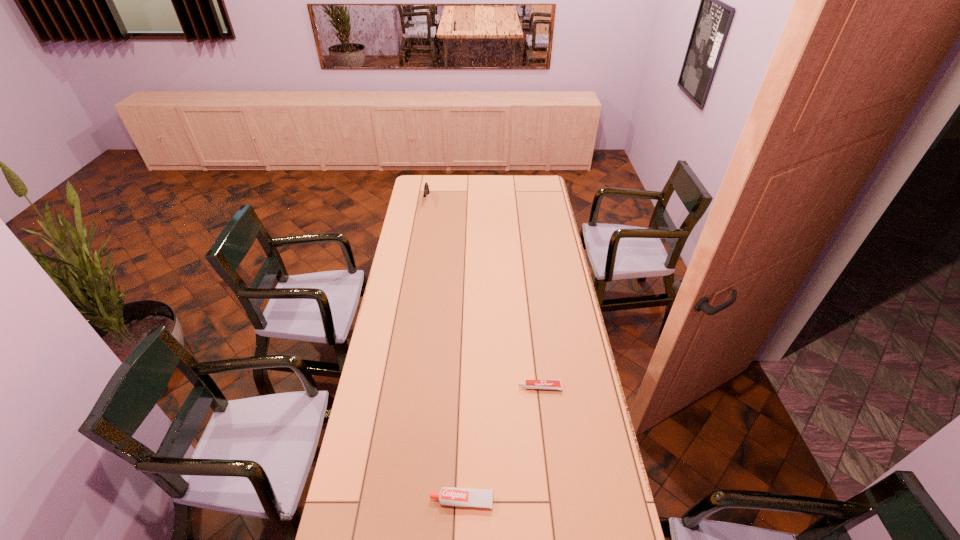
Find the location of a particular element. This screenshot has height=540, width=960. gun is located at coordinates (426, 187).

Where is `the tallest object`? the tallest object is located at coordinates (426, 187).

Find the location of a particular element. Image resolution: width=960 pixels, height=540 pixels. the second object from left to right is located at coordinates (450, 496).

Identify the location of the nearer toothpaste. This screenshot has height=540, width=960. (450, 496).

The image size is (960, 540). I want to click on the second nearest object, so click(x=554, y=384).

You are a GUI agent. You are given a task and a screenshot of the screen. Output one action in this format:
    pyautogui.click(x=<x>, y=<y>)
    Task: Click on the shortest object
    The image size is (960, 540).
    Given the screenshot: What is the action you would take?
    pyautogui.click(x=554, y=384)

You are a GUI agent. You are given a task and a screenshot of the screen. Output one action in this format:
    pyautogui.click(x=<x>, y=<y>)
    Task: Click on the vacant space located 0.110m at the end of the barrel of the leftmost object
    Image resolution: width=960 pixels, height=540 pixels.
    Given the screenshot: What is the action you would take?
    pyautogui.click(x=423, y=219)

Find the location of a particular element. The height and width of the screenshot is (540, 960). free space located on the right of the nearest object is located at coordinates (602, 501).

I want to click on vacant space situated 0.330m at the nozzle of the rightmost object, so click(x=429, y=387).

Locate an element on the screen. Image resolution: width=960 pixels, height=540 pixels. vacant area located at the nozzle of the rightmost object is located at coordinates (481, 387).